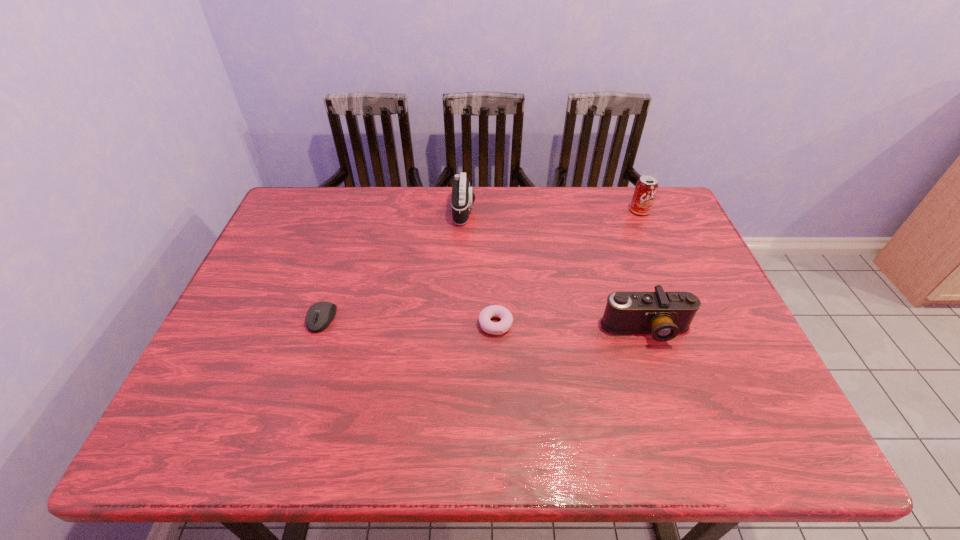
Where is `vacant point located on the left of the leftmost object`? vacant point located on the left of the leftmost object is located at coordinates (286, 319).

I want to click on soda can at the far edge, so click(646, 188).

At what (x,y) coordinates should I click in order to perform the action: click on camera that is at the far edge. Please return your answer as a coordinate pair (x, y). The width and height of the screenshot is (960, 540). Looking at the image, I should click on (462, 199).

The height and width of the screenshot is (540, 960). What are the coordinates of `soda can present at the right edge` in the screenshot? It's located at (646, 188).

Identify the location of camera at the right edge. This screenshot has width=960, height=540. (664, 315).

This screenshot has width=960, height=540. What are the coordinates of `object that is positioned at the far right corner` in the screenshot? It's located at (646, 188).

I want to click on blank space at the far edge of the desktop, so click(x=356, y=227).

In the image, there is a desktop. In order to click on free region at the near edge in this screenshot , I will do `click(411, 426)`.

What are the coordinates of `free space at the left edge of the desktop` in the screenshot? It's located at (233, 367).

Locate an element on the screen. The height and width of the screenshot is (540, 960). vacant region at the right edge of the desktop is located at coordinates (643, 232).